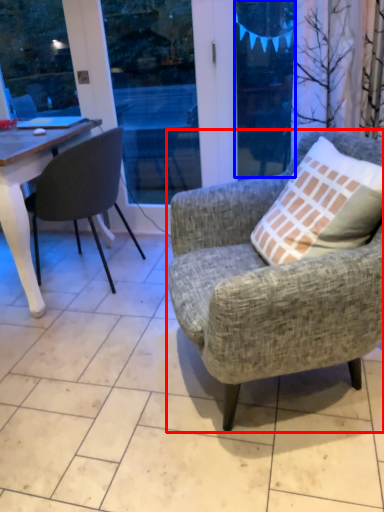
Question: Which of the following is the closest to the observer, chair (highlighted by a red box) or window screen (highlighted by a blue box)?

Choices:
 (A) chair
 (B) window screen

Answer: (A)